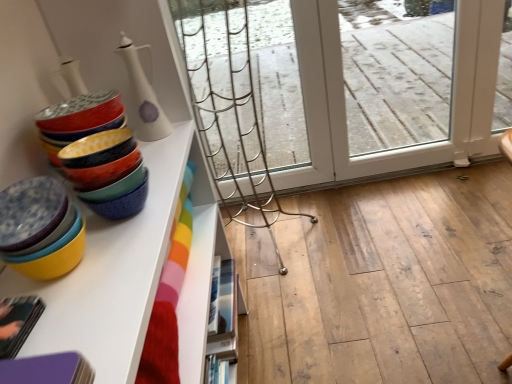
Question: Can you confirm if white glossy bookshelf at lower center is smaller than matte ceramic bowls at left?

Choices:
 (A) no
 (B) yes

Answer: (A)

Question: Is the depth of white glossy bookshelf at lower center less than that of matte ceramic bowls at left?

Choices:
 (A) no
 (B) yes

Answer: (A)

Question: From a real-world perspective, is white glossy bookshelf at lower center over matte ceramic bowls at left?

Choices:
 (A) yes
 (B) no

Answer: (B)

Question: Does white glossy bookshelf at lower center appear on the right side of matte ceramic bowls at left?

Choices:
 (A) no
 (B) yes

Answer: (B)

Question: Is white glossy bookshelf at lower center positioned with its back to matte ceramic bowls at left?

Choices:
 (A) yes
 (B) no

Answer: (B)

Question: Does white glossy bookshelf at lower center have a greater width compared to matte ceramic bowls at left?

Choices:
 (A) yes
 (B) no

Answer: (B)

Question: Is white glossy bookshelf at lower center shorter than matte ceramic bowls at left, which is the 1th tableware in front-to-back order?

Choices:
 (A) no
 (B) yes

Answer: (A)

Question: From a real-world perspective, does white glossy bookshelf at lower center sit lower than matte ceramic bowls at left, positioned as the second tableware in back-to-front order?

Choices:
 (A) yes
 (B) no

Answer: (A)

Question: Is white glossy bookshelf at lower center outside matte ceramic bowls at left, which appears as the 2th tableware when viewed from the top?

Choices:
 (A) no
 (B) yes

Answer: (B)

Question: Is white glossy bookshelf at lower center bigger than matte ceramic bowls at left, positioned as the second tableware in back-to-front order?

Choices:
 (A) yes
 (B) no

Answer: (A)

Question: From a real-world perspective, is white glossy bookshelf at lower center over matte ceramic bowls at left, which appears as the 2th tableware when viewed from the top?

Choices:
 (A) no
 (B) yes

Answer: (A)

Question: From the image's perspective, is white glossy bookshelf at lower center on top of matte ceramic bowls at left, positioned as the second tableware in back-to-front order?

Choices:
 (A) yes
 (B) no

Answer: (B)

Question: Are white glossy vase at upper left, the 2th tableware when ordered from bottom to top, and white glossy bookshelf at lower center making contact?

Choices:
 (A) yes
 (B) no

Answer: (B)